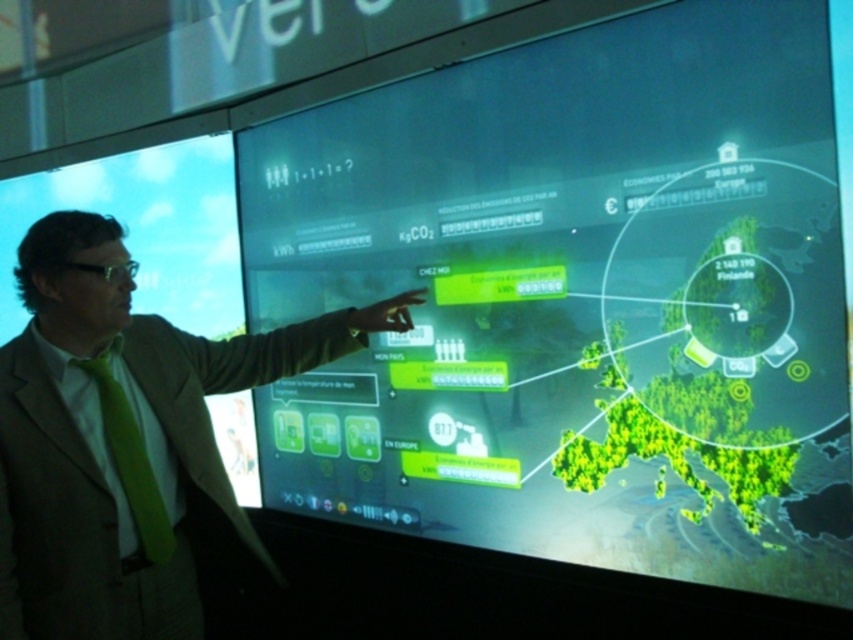
You are an attendee at a presentation and notice the presenter wearing a green silk tie at left and pointing at a green matte map at center. Since both are green, can you tell which one is bigger?

The green matte map at center is larger in size than the green silk tie at left.

You are an assistant attending a presentation. The presenter is wearing a green silk tie at left. If you need to point to the equation on the screen, which is at the top left corner, would your hand movement be towards the left or right side of the presenter?

The green silk tie at left is located at point (131,449), which is on the left side of the presenter. The equation is at the top left corner of the screen. To point to the equation, you would move your hand towards the left side of the presenter, as both the tie and the equation are on the left relative to the presenter.

Based on the scene where a man in a beige suit is pointing at a large interactive screen showing an equation and energy data, can you determine which of the two points, point (125,273) or point (123,484), is closer to the viewer?

Point (123,484) is closer to the viewer because the Objects Description states that point (125,273) is behind point (123,484).